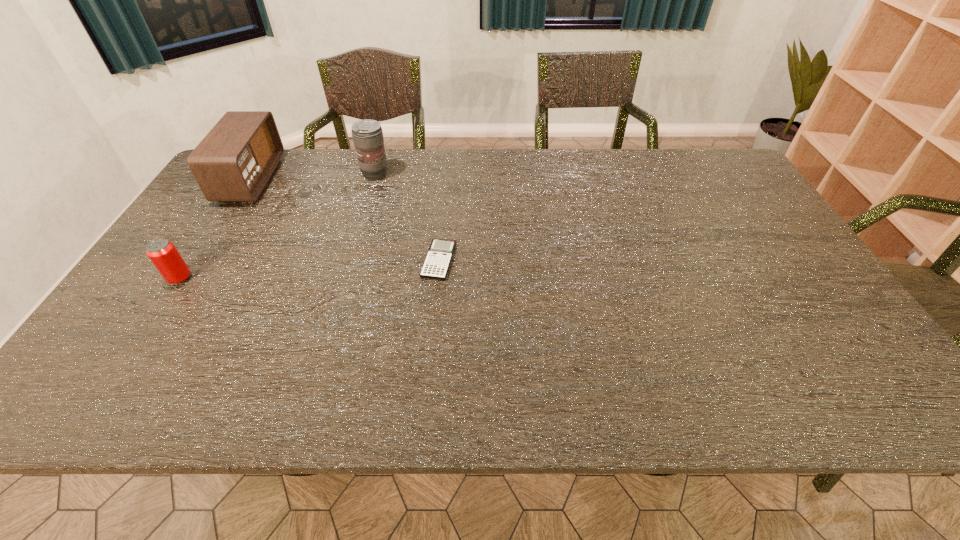
Identify the location of the second object from right to left. This screenshot has width=960, height=540. (367, 134).

This screenshot has width=960, height=540. What are the coordinates of `radio receiver` in the screenshot? It's located at (234, 161).

Locate an element on the screen. The image size is (960, 540). the second shortest object is located at coordinates (163, 254).

This screenshot has height=540, width=960. Identify the location of the rightmost object. (436, 265).

At what (x,y) coordinates should I click in order to perform the action: click on calculator. Please return your answer as a coordinate pair (x, y). Image resolution: width=960 pixels, height=540 pixels. Looking at the image, I should click on (436, 265).

Identify the location of free spot located 0.180m on the side of the telephoto lens where the control switches are located. The height and width of the screenshot is (540, 960). (444, 174).

Where is `vacant area situated 0.280m on the front-facing side of the radio receiver`? vacant area situated 0.280m on the front-facing side of the radio receiver is located at coordinates (359, 179).

Identify the location of vacant position located 0.240m on the front of the can. This screenshot has height=540, width=960. (119, 371).

Identify the location of vacant space located 0.390m on the right of the rightmost object. (605, 261).

Find the location of a particular element. The height and width of the screenshot is (540, 960). telephoto lens at the far edge is located at coordinates (367, 134).